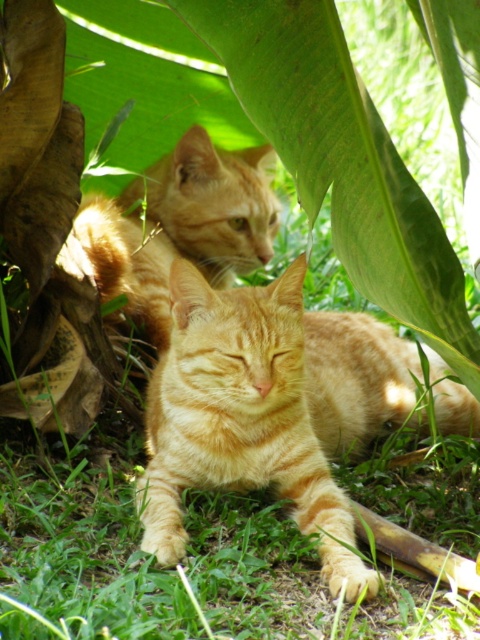
You are a photographer trying to capture both the green leafy at upper center and the orange tabby cat at upper center in a single frame. Which object should you adjust your camera angle to focus on first if you want to include both in your shot?

The green leafy at upper center is positioned on the right side of orange tabby cat at upper center. To include both in the shot, you should first focus on the orange tabby cat at upper center and then adjust your angle to include the green leafy at upper center on its right side.

You are a photographer adjusting your camera to focus on two specific points in the image. The first point is at coordinates point [462,326], and the second is at point [213,280]. Which point should you focus on first if you want to capture the foreground cat clearly?

You should focus on point [462,326] first because it is closer to the camera than point [213,280], ensuring the foreground cat is in clear focus.

You are a photographer trying to capture a photo of the orange fur cat at center and the green leafy at upper center. From your current position, which object is located to the left of the other?

The orange fur cat at center is positioned on the right side of green leafy at upper center, so the green leafy at upper center is to the left of the orange fur cat at center.